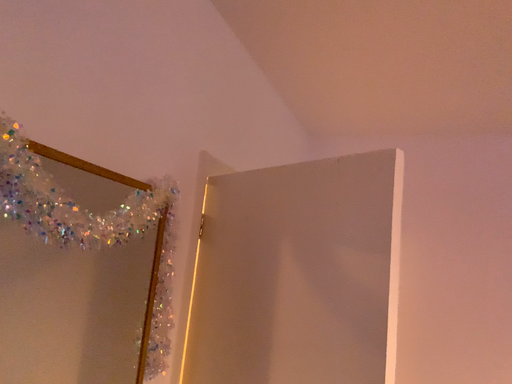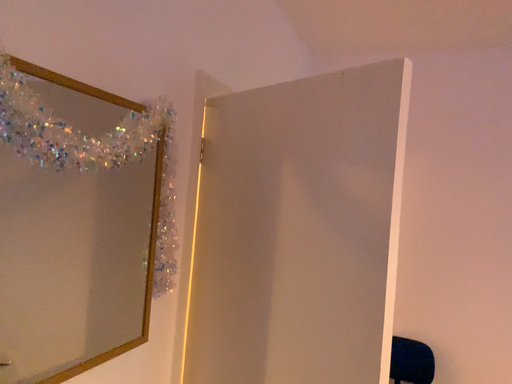
Question: How did the camera likely rotate when shooting the video?

Choices:
 (A) rotated downward
 (B) rotated upward

Answer: (A)